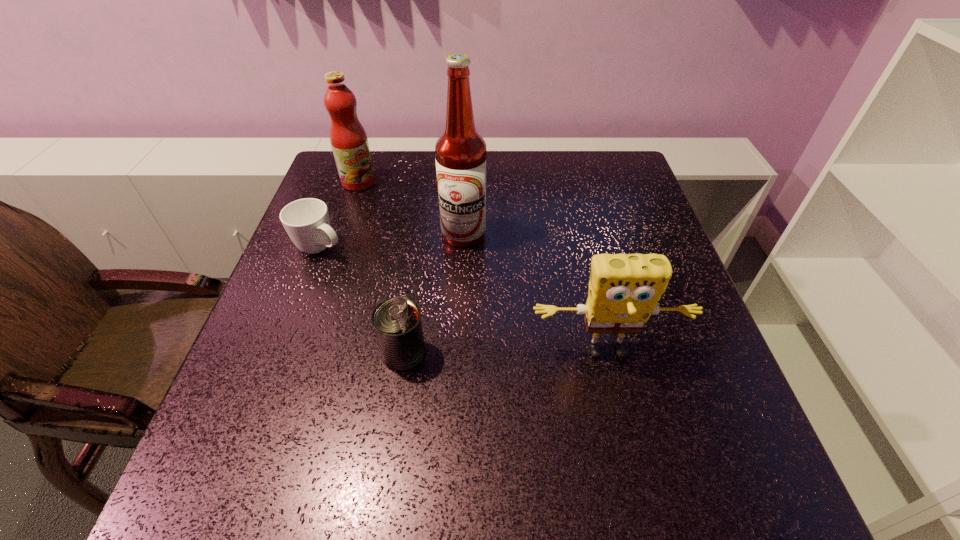
Where is `vacant space located 0.110m on the face of the third tallest object`? Image resolution: width=960 pixels, height=540 pixels. vacant space located 0.110m on the face of the third tallest object is located at coordinates (625, 429).

Identify the location of vacant position located on the label side of the tallest object. point(473,310).

Where is `vacant space positioned 0.060m on the label side of the tallest object`? Image resolution: width=960 pixels, height=540 pixels. vacant space positioned 0.060m on the label side of the tallest object is located at coordinates (468, 267).

Locate an element on the screen. vacant region located 0.110m on the label side of the tallest object is located at coordinates (469, 282).

Find the location of a particular element. free space located 0.160m with the handle on the side of the shortest object is located at coordinates (391, 285).

Locate an element on the screen. This screenshot has height=540, width=960. free space located 0.130m with the handle on the side of the shortest object is located at coordinates (381, 279).

Where is `vacant space located with the handle on the side of the shortest object`? The width and height of the screenshot is (960, 540). vacant space located with the handle on the side of the shortest object is located at coordinates (365, 270).

The height and width of the screenshot is (540, 960). What are the coordinates of `free space located 0.400m on the front label of the fruit juice` in the screenshot? It's located at (449, 271).

Where is `blank space located 0.090m on the front label of the fruit juice`? The image size is (960, 540). blank space located 0.090m on the front label of the fruit juice is located at coordinates (382, 205).

You are a GUI agent. You are given a task and a screenshot of the screen. Output one action in this format:
    pyautogui.click(x=<x>, y=<y>)
    Task: Click on the free space located on the front label of the fruit juice
    
    Given the screenshot: What is the action you would take?
    pyautogui.click(x=382, y=205)